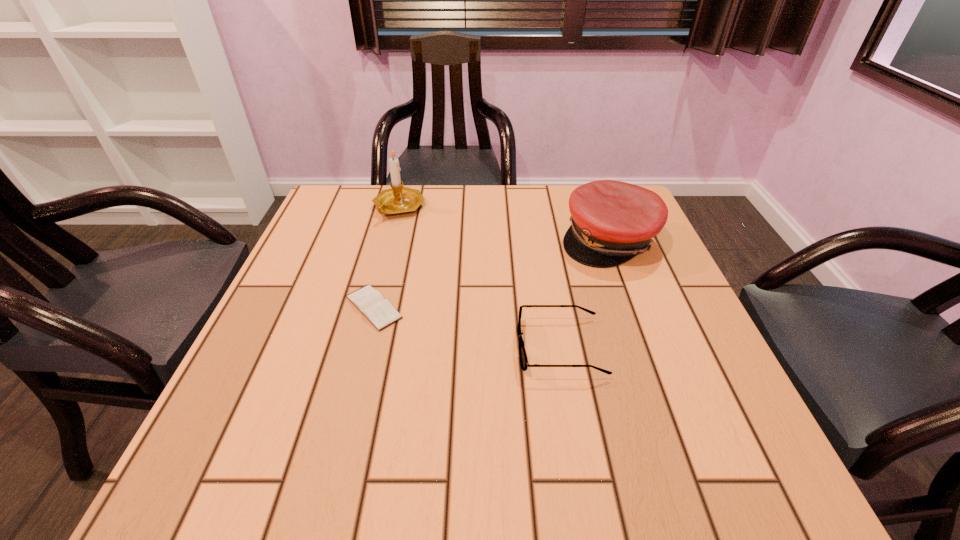
Locate an element on the screen. The width and height of the screenshot is (960, 540). free region at the right edge of the desktop is located at coordinates (675, 303).

At what (x,y) coordinates should I click in order to perform the action: click on free spot at the far left corner of the desktop. Please return your answer as a coordinate pair (x, y). Image resolution: width=960 pixels, height=540 pixels. Looking at the image, I should click on (343, 210).

I want to click on vacant region at the near right corner of the desktop, so click(766, 458).

In order to click on free space between the candle holder and the shortest object in this screenshot , I will do `click(386, 258)`.

This screenshot has width=960, height=540. Find the location of `empty space between the cap and the spectacles`. empty space between the cap and the spectacles is located at coordinates (585, 293).

Locate an element on the screen. empty space that is in between the cap and the shortest object is located at coordinates (492, 273).

Locate an element on the screen. The height and width of the screenshot is (540, 960). blank region between the second tallest object and the diary is located at coordinates (492, 273).

Where is `free area in between the spectacles and the cap`? free area in between the spectacles and the cap is located at coordinates (585, 293).

At what (x,y) coordinates should I click in order to perform the action: click on unoccupied position between the diary and the third tallest object. Please return your answer as a coordinate pair (x, y). The height and width of the screenshot is (540, 960). Looking at the image, I should click on (467, 327).

You are a GUI agent. You are given a task and a screenshot of the screen. Output one action in this format:
    pyautogui.click(x=<x>, y=<y>)
    Task: Click on the unoccupied area between the cap and the tallest object
    This screenshot has width=960, height=540.
    Given the screenshot: What is the action you would take?
    (504, 223)